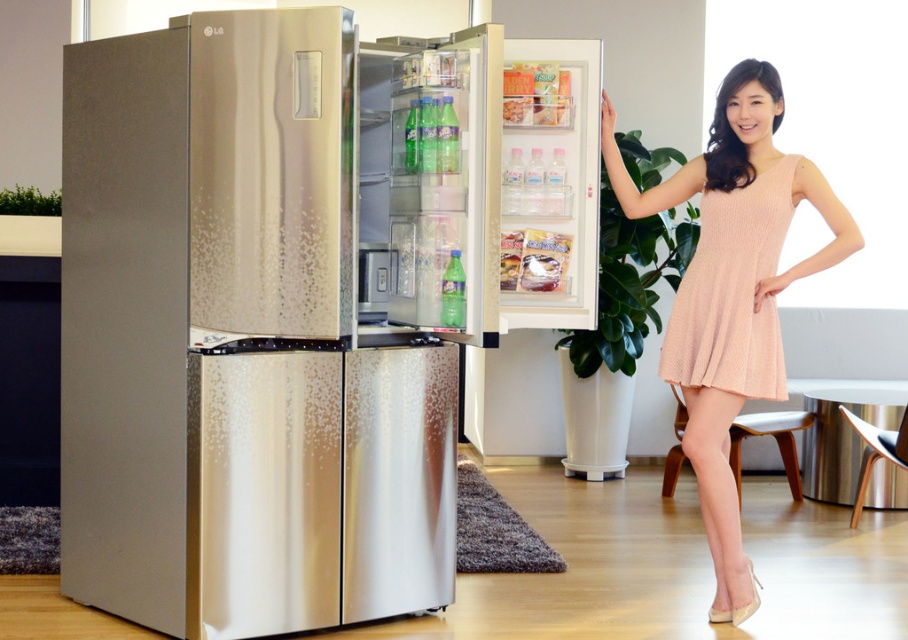
Question: Which object is farther from the camera taking this photo?

Choices:
 (A) peach textured dress at right
 (B) brushed metal refrigerator at center
 (C) pink knit dress at center

Answer: (A)

Question: Can you confirm if pink knit dress at center is thinner than peach textured dress at right?

Choices:
 (A) no
 (B) yes

Answer: (A)

Question: Which object is the closest to the peach textured dress at right?

Choices:
 (A) pink knit dress at center
 (B) brushed metal refrigerator at center

Answer: (A)

Question: Which object appears closest to the camera in this image?

Choices:
 (A) brushed metal refrigerator at center
 (B) peach textured dress at right
 (C) pink knit dress at center

Answer: (A)

Question: Observing the image, what is the correct spatial positioning of brushed metal refrigerator at center in reference to pink knit dress at center?

Choices:
 (A) above
 (B) below

Answer: (A)

Question: Is brushed metal refrigerator at center above peach textured dress at right?

Choices:
 (A) yes
 (B) no

Answer: (B)